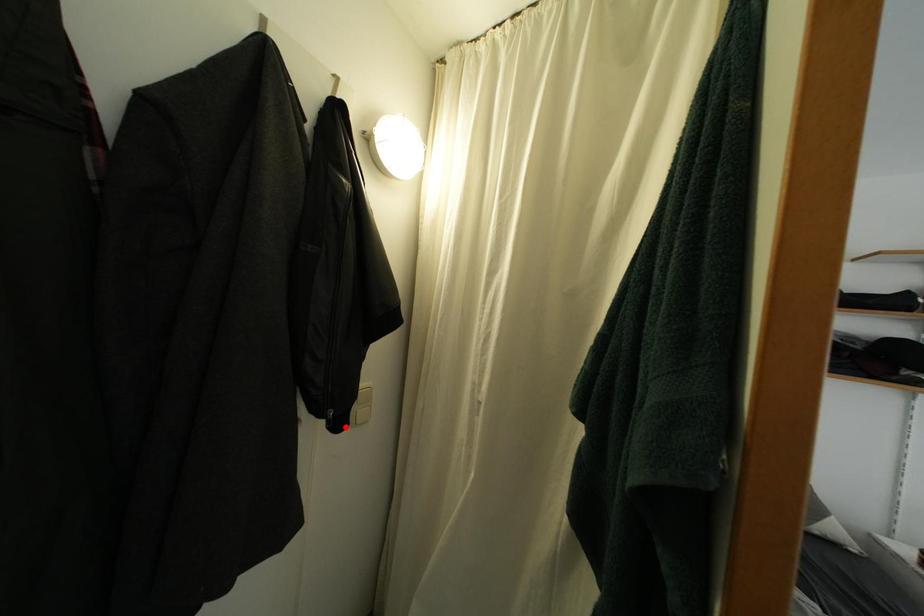
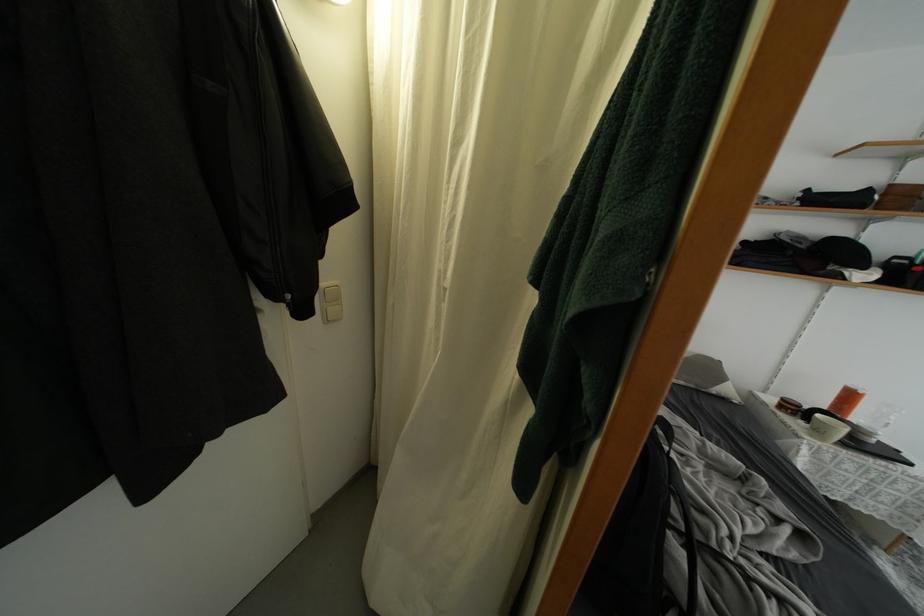
Question: I am providing you with two images of the same scene from different viewpoints. In image1, a red point is highlighted. Considering the same 3D point in image2, which of the following is correct?

Choices:
 (A) It is closer
 (B) It is farther

Answer: (A)